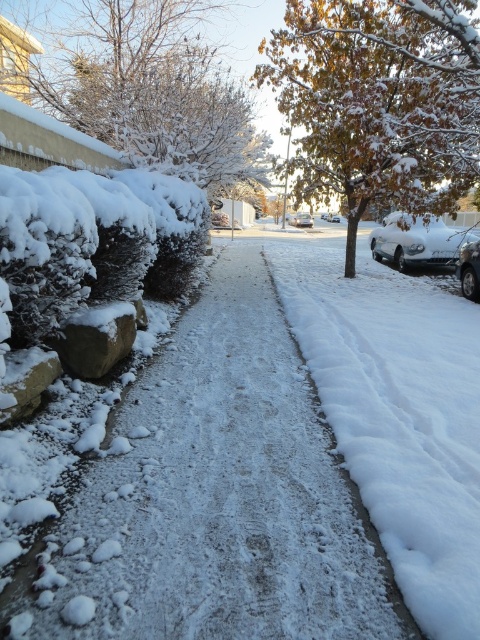
Question: Observing the image, what is the correct spatial positioning of white matte car at right in reference to sleek silver sedan at right?

Choices:
 (A) above
 (B) below

Answer: (A)

Question: From the image, what is the correct spatial relationship of sleek silver sedan at right in relation to white glossy car at center?

Choices:
 (A) right
 (B) left

Answer: (B)

Question: Estimate the real-world distances between objects in this image. Which object is closer to the white snow-covered pavement at center?

Choices:
 (A) smooth concrete curb at center
 (B) white glossy car at center
 (C) sleek silver sedan at right
 (D) metallic silver sedan at center

Answer: (A)

Question: Does white snow-covered pavement at center lie in front of white frosty bush at upper left?

Choices:
 (A) no
 (B) yes

Answer: (B)

Question: Considering the real-world distances, which object is farthest from the smooth concrete curb at center?

Choices:
 (A) metallic silver sedan at center
 (B) sleek silver sedan at right
 (C) white matte car at right

Answer: (A)

Question: Which object appears closest to the camera in this image?

Choices:
 (A) snow-covered tree at upper center
 (B) white glossy car at center
 (C) white frosty bush at upper left

Answer: (A)